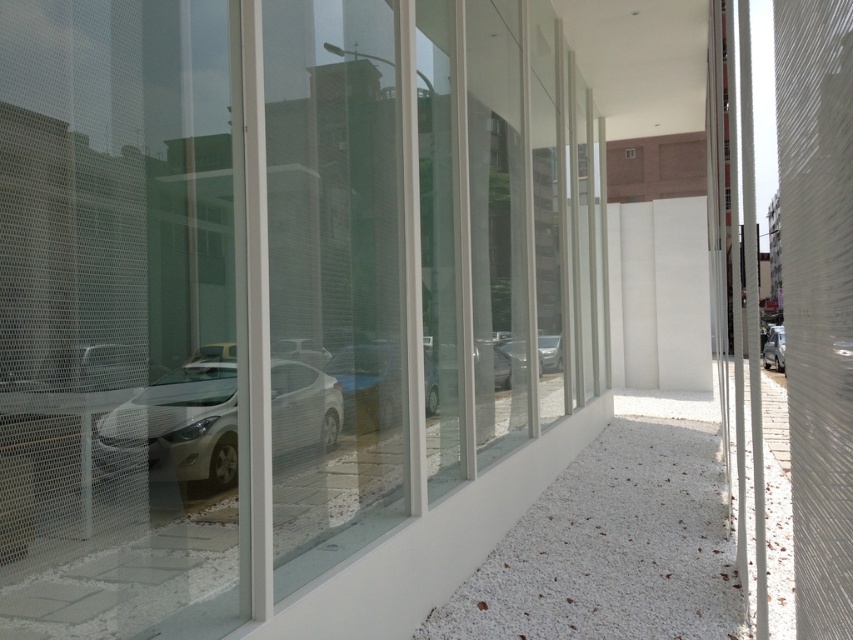
Question: Which object is the farthest from the transparent glass door at center?

Choices:
 (A) matte silver car at center
 (B) metallic silver car at right
 (C) white glossy car at left

Answer: (B)

Question: Can you confirm if transparent glass door at center is thinner than metallic silver car at right?

Choices:
 (A) no
 (B) yes

Answer: (B)

Question: In this image, where is white glossy car at left located relative to metallic silver car at right?

Choices:
 (A) below
 (B) above

Answer: (B)

Question: Does transparent glass door at center appear on the left side of matte silver car at center?

Choices:
 (A) no
 (B) yes

Answer: (B)

Question: Which object is closer to the camera taking this photo?

Choices:
 (A) metallic silver car at right
 (B) transparent glass door at center
 (C) matte silver car at center
 (D) white glossy car at left

Answer: (B)

Question: Estimate the real-world distances between objects in this image. Which object is farther from the matte silver car at center?

Choices:
 (A) transparent glass door at center
 (B) white glossy car at left
 (C) metallic silver car at right

Answer: (C)